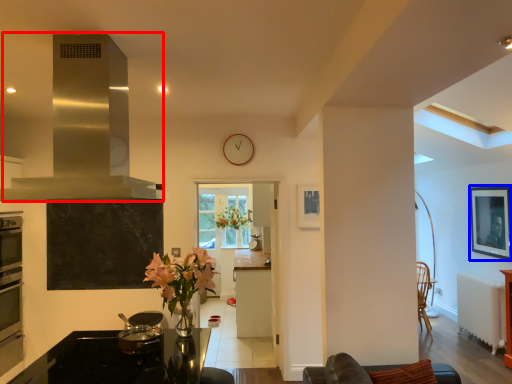
Question: Which of the following is the farthest to the observer, exhaust hood (highlighted by a red box) or picture frame (highlighted by a blue box)?

Choices:
 (A) exhaust hood
 (B) picture frame

Answer: (B)